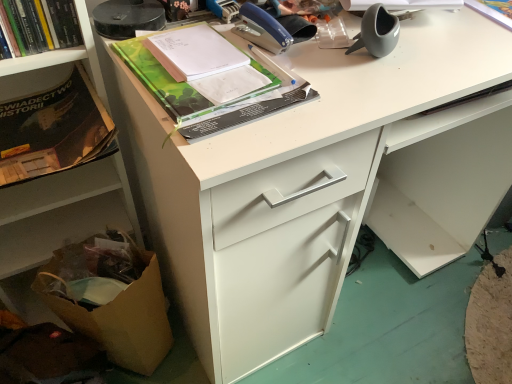
Where is `free space that is in between blue plastic stapler at upper center, the 1th office supplies positioned from the left, and matte gray vase at upper right, which is the 2th office supplies in left-to-right order`? Image resolution: width=512 pixels, height=384 pixels. free space that is in between blue plastic stapler at upper center, the 1th office supplies positioned from the left, and matte gray vase at upper right, which is the 2th office supplies in left-to-right order is located at coordinates (324, 50).